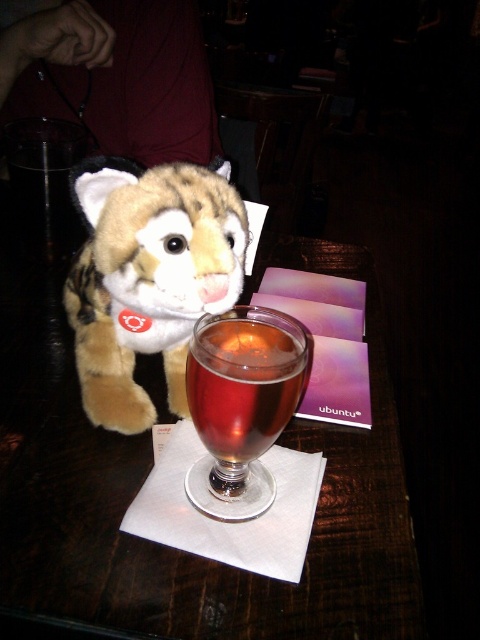
You are a customer sitting at the wooden table at center and want to pick up the fuzzy brown plush toy at upper left. Can you reach it without moving your chair?

The wooden table at center is below the fuzzy brown plush toy at upper left, which means the plush toy is placed higher up on the table. Since the toy is positioned higher, you might need to stretch or adjust your position slightly to reach it, but it should be accessible without moving the chair.

You are a customer at this bar and want to place your phone on the wooden table at center without disturbing the fuzzy brown plush toy at upper left. Can you do so? Please explain.

The wooden table at center and fuzzy brown plush toy at upper left are 5.92 inches apart. Since the distance between them is sufficient, you can place your phone on the wooden table at center without disturbing the fuzzy brown plush toy at upper left.

From the picture: You are a bartender preparing to clean the area around the fuzzy brown plush toy at upper left and the translucent glass wine glass at center. Which object should you move first to avoid obstructing the other?

You should move the fuzzy brown plush toy at upper left first because it is positioned over the translucent glass wine glass at center, so moving it first will allow access to the glass below without obstruction.